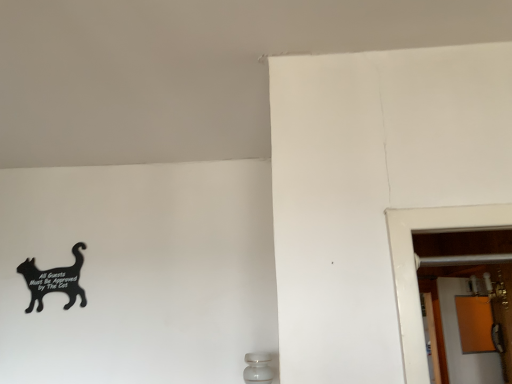
Question: Considering the positions of black matte sign at lower left and orange matte screen door at right in the image, is black matte sign at lower left wider or thinner than orange matte screen door at right?

Choices:
 (A) thin
 (B) wide

Answer: (A)

Question: From the image's perspective, is black matte sign at lower left located above or below orange matte screen door at right?

Choices:
 (A) above
 (B) below

Answer: (A)

Question: From a real-world perspective, is black matte sign at lower left physically located above or below orange matte screen door at right?

Choices:
 (A) above
 (B) below

Answer: (A)

Question: Is orange matte screen door at right bigger or smaller than black matte sign at lower left?

Choices:
 (A) big
 (B) small

Answer: (A)

Question: Is orange matte screen door at right inside or outside of black matte sign at lower left?

Choices:
 (A) inside
 (B) outside

Answer: (B)

Question: In terms of height, does orange matte screen door at right look taller or shorter compared to black matte sign at lower left?

Choices:
 (A) short
 (B) tall

Answer: (B)

Question: Looking at their shapes, would you say orange matte screen door at right is wider or thinner than black matte sign at lower left?

Choices:
 (A) thin
 (B) wide

Answer: (B)